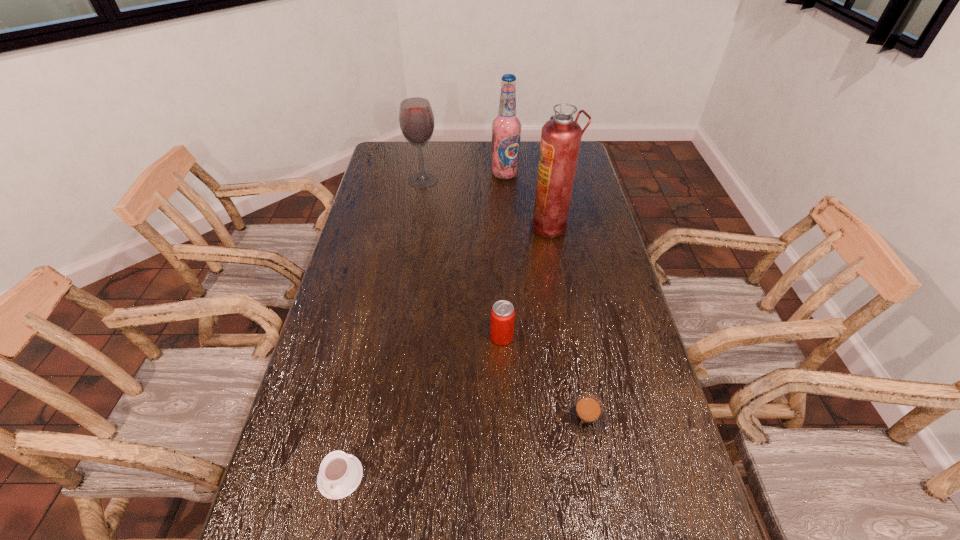
The width and height of the screenshot is (960, 540). What are the coordinates of `fire extinguisher` in the screenshot? It's located at (561, 137).

At what (x,y) coordinates should I click in order to perform the action: click on the right alcohol. Please return your answer as a coordinate pair (x, y). Looking at the image, I should click on (506, 128).

This screenshot has width=960, height=540. In order to click on the fourth shortest object in this screenshot , I will do `click(416, 119)`.

Locate an element on the screen. The width and height of the screenshot is (960, 540). the shorter alcohol is located at coordinates (416, 119).

You are a GUI agent. You are given a task and a screenshot of the screen. Output one action in this format:
    pyautogui.click(x=<x>, y=<y>)
    Task: Click on the can
    This screenshot has width=960, height=540.
    Given the screenshot: What is the action you would take?
    click(x=502, y=313)

You are a GUI agent. You are given a task and a screenshot of the screen. Output one action in this format:
    pyautogui.click(x=<x>, y=<y>)
    Task: Click on the third shortest object
    
    Given the screenshot: What is the action you would take?
    pyautogui.click(x=502, y=313)

Where is `the fifth farthest object`? This screenshot has height=540, width=960. the fifth farthest object is located at coordinates (585, 414).

Find the location of a particular element. This screenshot has width=960, height=540. teacup is located at coordinates (340, 474).

The image size is (960, 540). Find the location of `blank area located 0.110m on the side of the third farthest object with the label`. blank area located 0.110m on the side of the third farthest object with the label is located at coordinates (501, 227).

The image size is (960, 540). Identify the location of vacant space located 0.180m on the side of the third farthest object with the label. tap(482, 227).